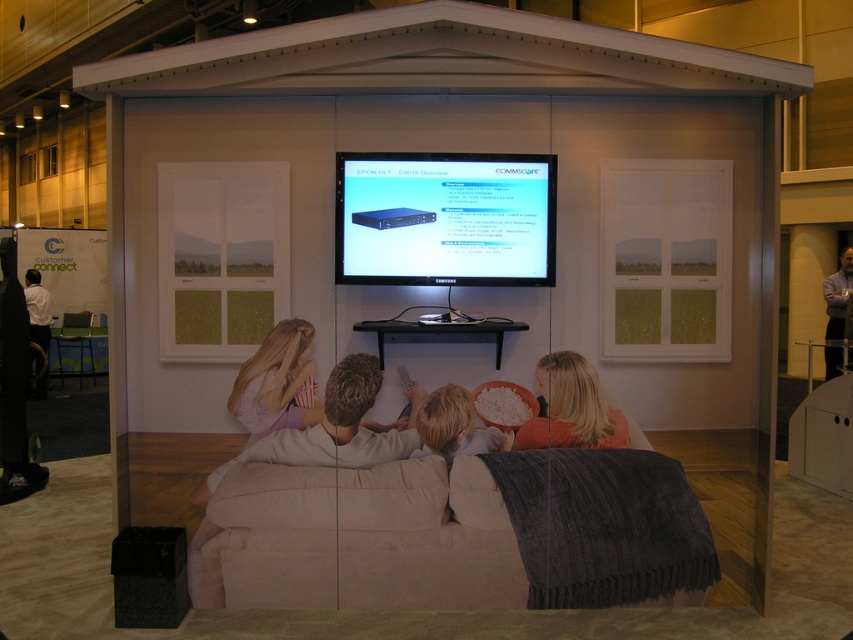
Please provide the coordinates of the matte black monitor at center in the image.

The coordinates of the matte black monitor at center are at point (x=444, y=218).

You are a visitor at the trade show and want to know if the matte black monitor at center is taller than the light brown fabric couch at center. Can you determine this based on the scene?

The matte black monitor at center is not as tall as the light brown fabric couch at center, so the couch is taller than the monitor.